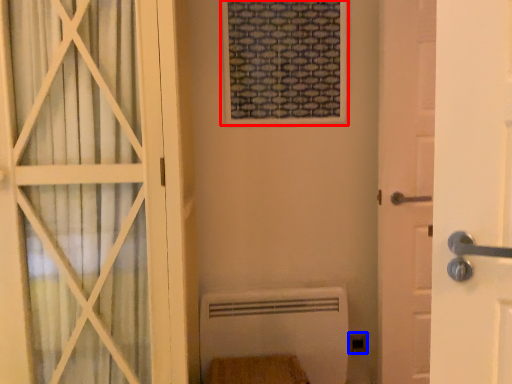
Question: Which of the following is the closest to the observer, window frame (highlighted by a red box) or electric outlet (highlighted by a blue box)?

Choices:
 (A) window frame
 (B) electric outlet

Answer: (A)